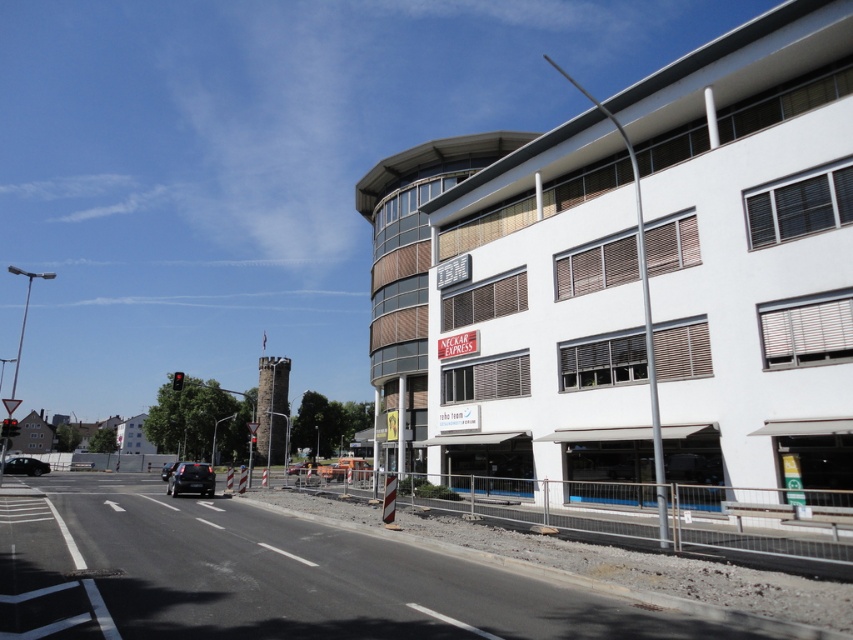
Question: Is the position of black glossy car at lower left less distant than that of matte black car at center?

Choices:
 (A) no
 (B) yes

Answer: (A)

Question: Does shiny black car at center appear over black glossy car at lower left?

Choices:
 (A) no
 (B) yes

Answer: (B)

Question: Among these points, which one is farthest from the camera?

Choices:
 (A) (39, 470)
 (B) (177, 483)
 (C) (177, 461)

Answer: (C)

Question: Does shiny black car at center have a greater width compared to matte black car at center?

Choices:
 (A) no
 (B) yes

Answer: (A)

Question: Which is nearer to the black glossy car at lower left?

Choices:
 (A) shiny black car at center
 (B) matte black car at center

Answer: (B)

Question: Which object is positioned closest to the matte black car at center?

Choices:
 (A) shiny black car at center
 (B) black glossy car at lower left

Answer: (A)